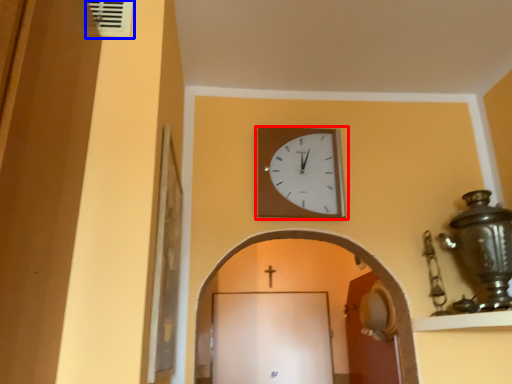
Question: Which point is further to the camera, wall clock (highlighted by a red box) or air conditioning (highlighted by a blue box)?

Choices:
 (A) wall clock
 (B) air conditioning

Answer: (A)